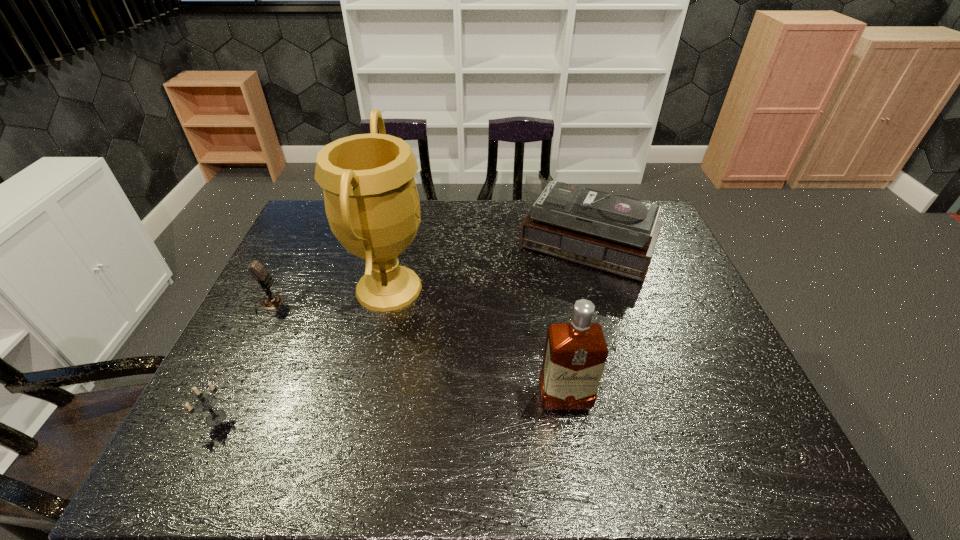
The image size is (960, 540). I want to click on the third object from right to left, so click(x=372, y=204).

The height and width of the screenshot is (540, 960). In order to click on trophy in this screenshot , I will do `click(372, 204)`.

You are a GUI agent. You are given a task and a screenshot of the screen. Output one action in this format:
    pyautogui.click(x=<x>, y=<y>)
    Task: Click on the record player
    The height and width of the screenshot is (540, 960).
    Given the screenshot: What is the action you would take?
    pyautogui.click(x=616, y=233)

Image resolution: width=960 pixels, height=540 pixels. Identify the location of liquor. (575, 354).

The width and height of the screenshot is (960, 540). I want to click on microphone, so click(256, 269).

The image size is (960, 540). I want to click on the shortest object, so click(x=204, y=403).

At what (x,y) coordinates should I click in order to perform the action: click on free space located 0.390m on the engravings side of the trophy. Please return your answer as a coordinate pair (x, y). Image resolution: width=960 pixels, height=540 pixels. Looking at the image, I should click on (563, 288).

Image resolution: width=960 pixels, height=540 pixels. Identify the location of free space located on the front of the record player. (630, 402).

Find the location of a particular element. vacant area situated on the front label of the liquor is located at coordinates (576, 472).

The height and width of the screenshot is (540, 960). What are the coordinates of `vacant area situated 0.130m on the front-facing side of the microphone` in the screenshot? It's located at (328, 304).